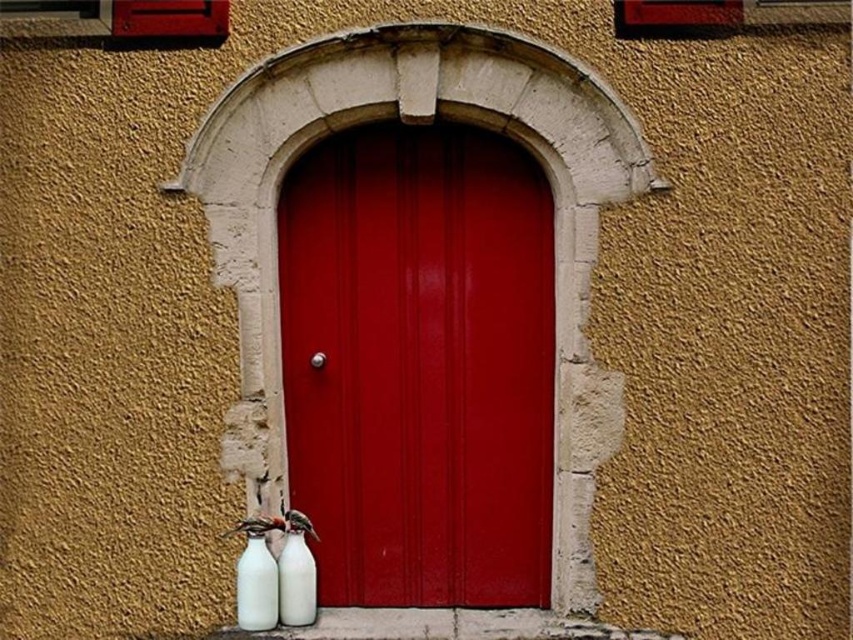
In the scene shown: Does glossy wood door at center have a smaller size compared to white glossy bottle at lower center?

Incorrect, glossy wood door at center is not smaller in size than white glossy bottle at lower center.

Is glossy wood door at center above white glossy bottle at lower center?

Yes.

This screenshot has width=853, height=640. I want to click on glossy wood door at center, so click(419, 364).

Which is more to the left, glossy wood door at center or white matte bottle at lower left?

From the viewer's perspective, white matte bottle at lower left appears more on the left side.

The width and height of the screenshot is (853, 640). I want to click on glossy wood door at center, so click(x=419, y=364).

The image size is (853, 640). I want to click on white matte bottle at lower left, so click(x=256, y=586).

Is white matte bottle at lower left thinner than white glossy bottle at lower center?

In fact, white matte bottle at lower left might be wider than white glossy bottle at lower center.

Between point (264, 566) and point (282, 593), which one is positioned in front?

Point (264, 566) is more forward.

In order to click on white matte bottle at lower left in this screenshot , I will do `click(256, 586)`.